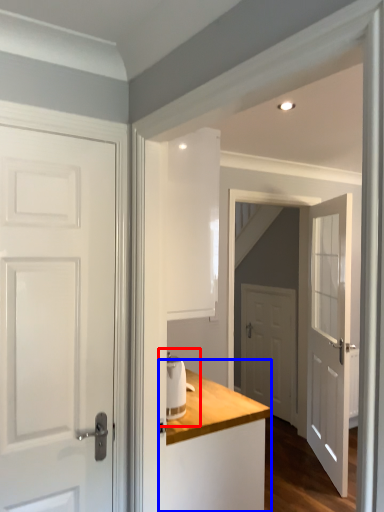
Question: Which of the following is the closest to the observer, sink (highlighted by a red box) or dresser (highlighted by a blue box)?

Choices:
 (A) sink
 (B) dresser

Answer: (B)